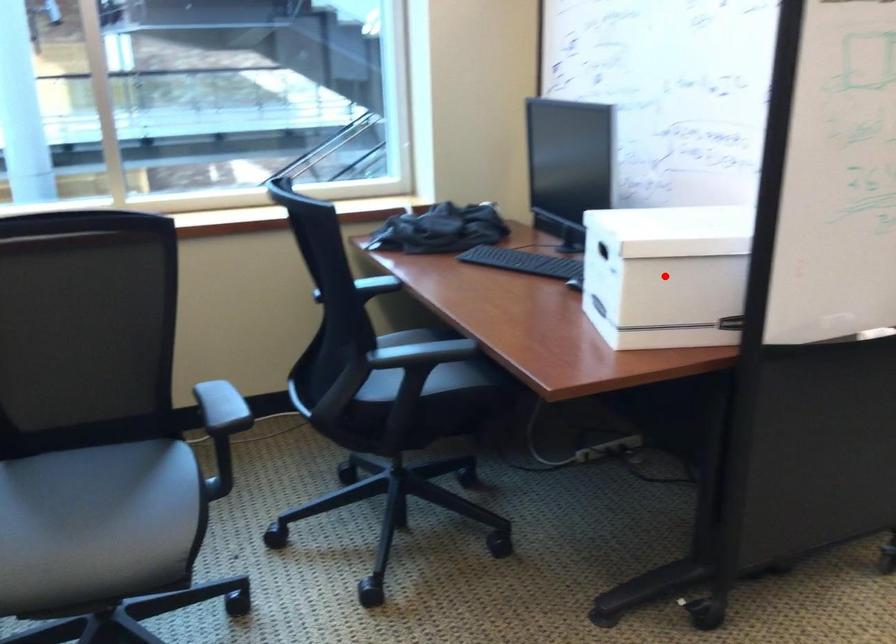
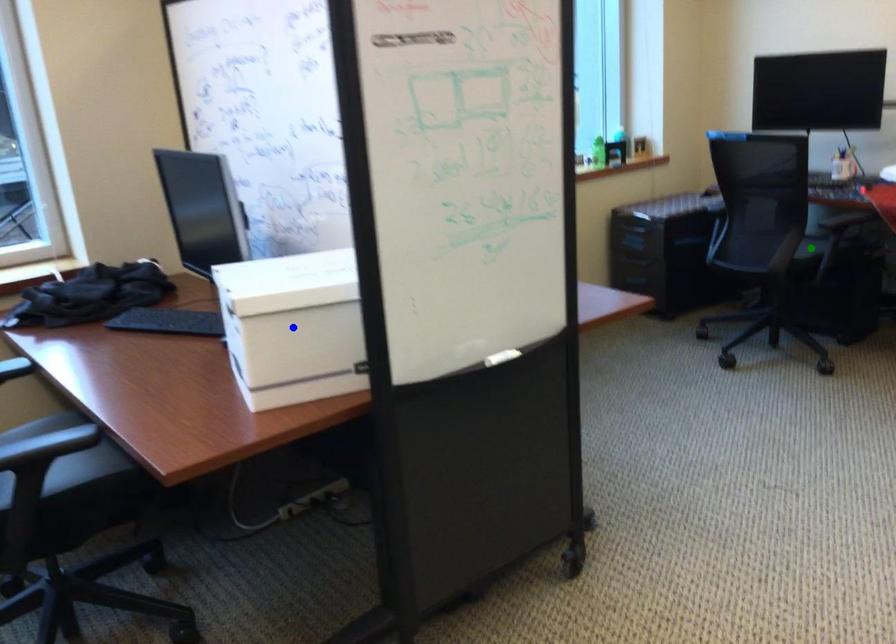
Question: I am providing you with two images of the same scene from different viewpoints. A red point is marked on the first image. You are given multiple points on the second image. Which point in image 2 represents the same 3d spot as the red point in image 1?

Choices:
 (A) yellow point
 (B) blue point
 (C) green point

Answer: (A)